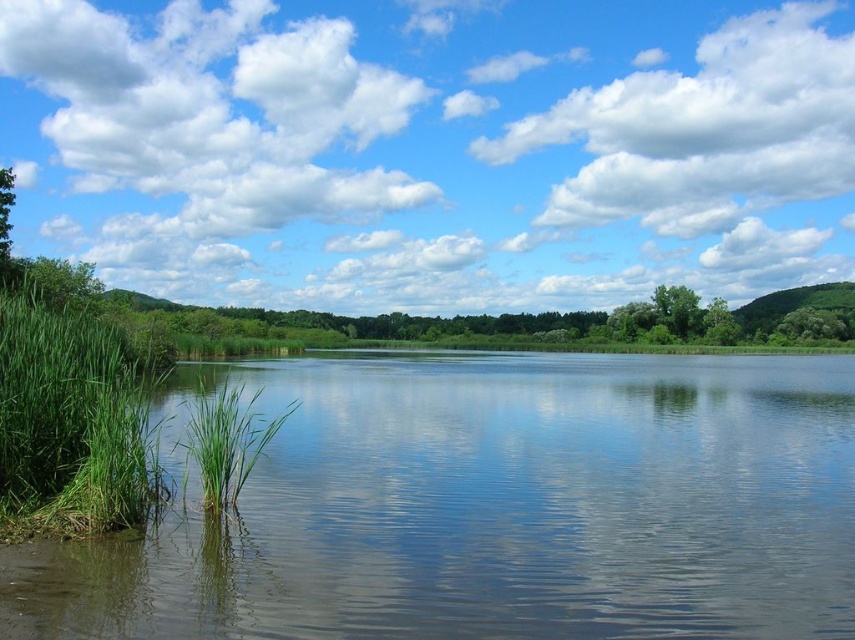
Can you confirm if green leafy grass at left is shorter than green leafy tree at left?

Yes.

Can you confirm if green leafy grass at left is positioned to the right of green leafy tree at left?

Correct, you'll find green leafy grass at left to the right of green leafy tree at left.

Is point (101, 400) positioned after point (4, 243)?

That is False.

The width and height of the screenshot is (855, 640). Find the location of `green leafy grass at left`. green leafy grass at left is located at coordinates (71, 408).

Based on the photo, is green leafy grass at left to the left of green leafy tree at center from the viewer's perspective?

Indeed, green leafy grass at left is positioned on the left side of green leafy tree at center.

Can you confirm if green leafy grass at left is thinner than green leafy tree at center?

No.

The width and height of the screenshot is (855, 640). What do you see at coordinates (71, 408) in the screenshot?
I see `green leafy grass at left` at bounding box center [71, 408].

Locate an element on the screen. This screenshot has height=640, width=855. green leafy grass at left is located at coordinates click(x=71, y=408).

Can you confirm if green matte grass at lower left is positioned below green leafy tree at center?

Correct, green matte grass at lower left is located below green leafy tree at center.

How distant is green matte grass at lower left from green leafy tree at center?

green matte grass at lower left is 490.34 feet from green leafy tree at center.

This screenshot has width=855, height=640. Describe the element at coordinates (227, 440) in the screenshot. I see `green matte grass at lower left` at that location.

Image resolution: width=855 pixels, height=640 pixels. Find the location of `green matte grass at lower left`. green matte grass at lower left is located at coordinates (227, 440).